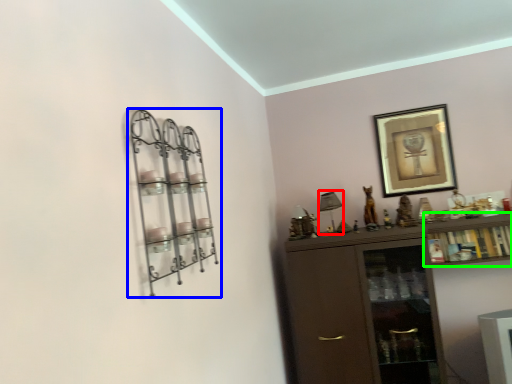
Question: Which object is positioned farthest from lamp (highlighted by a red box)? Select from shelf (highlighted by a blue box) and cabinet (highlighted by a green box).

Choices:
 (A) shelf
 (B) cabinet

Answer: (A)